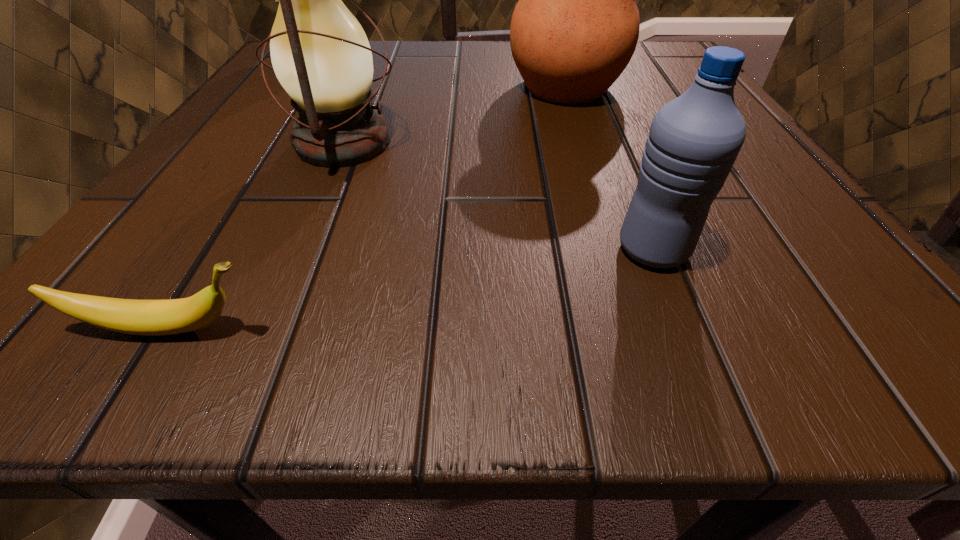
This screenshot has width=960, height=540. I want to click on object present at the near left corner, so click(x=173, y=316).

Where is `object located at the far right corner`? The image size is (960, 540). object located at the far right corner is located at coordinates coord(575,28).

Image resolution: width=960 pixels, height=540 pixels. Find the location of `free spot at the far edge of the desktop`. free spot at the far edge of the desktop is located at coordinates (427, 75).

This screenshot has height=540, width=960. I want to click on blank area at the near edge, so click(258, 363).

You are a GUI agent. You are given a task and a screenshot of the screen. Output one action in this format:
    pyautogui.click(x=<x>, y=<y>)
    Task: Click on the vacant space at the left edge of the desktop
    The width and height of the screenshot is (960, 540).
    Given the screenshot: What is the action you would take?
    pyautogui.click(x=208, y=247)

The height and width of the screenshot is (540, 960). Find the location of `vacant space at the right edge`. vacant space at the right edge is located at coordinates (716, 207).

In order to click on vacant area at the near left corner in this screenshot , I will do `click(38, 362)`.

Image resolution: width=960 pixels, height=540 pixels. In order to click on free space at the far right corner of the desktop in this screenshot , I will do `click(640, 70)`.

Locate an element on the screen. The image size is (960, 540). free space between the nearest object and the pottery is located at coordinates (368, 207).

Where is `free space between the second tallest object and the nearest object`? This screenshot has height=540, width=960. free space between the second tallest object and the nearest object is located at coordinates (256, 235).